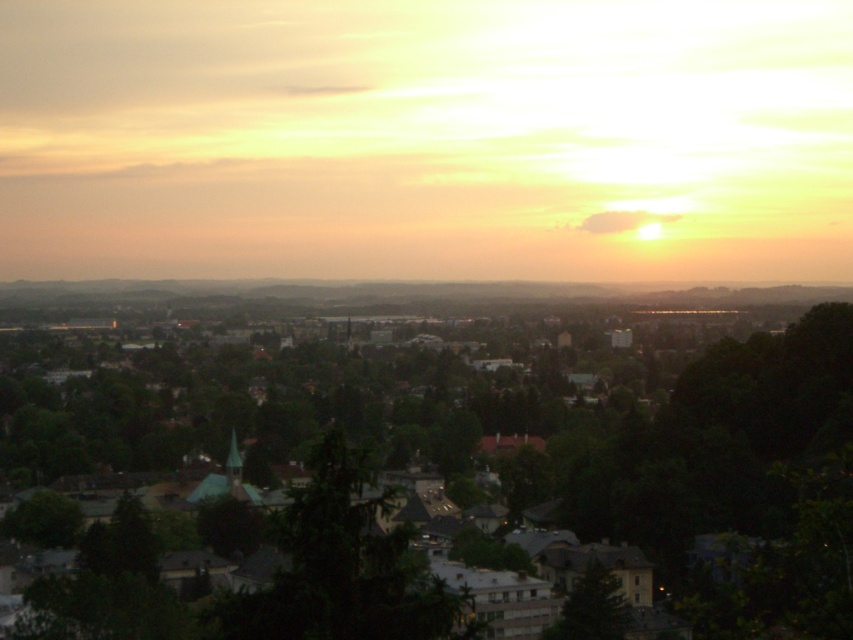
Question: Can you confirm if dark gray concrete buildings at center is wider than green matte tree at lower center?

Choices:
 (A) no
 (B) yes

Answer: (B)

Question: Is dark gray concrete buildings at center further to the viewer compared to green matte tree at lower center?

Choices:
 (A) yes
 (B) no

Answer: (B)

Question: Is dark gray concrete buildings at center bigger than green matte tree at lower center?

Choices:
 (A) no
 (B) yes

Answer: (B)

Question: Which object appears closest to the camera in this image?

Choices:
 (A) green matte tree at lower center
 (B) dark gray concrete buildings at center

Answer: (B)

Question: Which object appears farthest from the camera in this image?

Choices:
 (A) dark gray concrete buildings at center
 (B) green matte tree at lower center

Answer: (B)